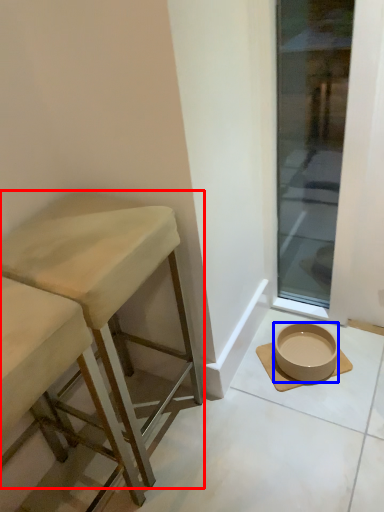
Question: Among these objects, which one is nearest to the camera, stool (highlighted by a red box) or bowl (highlighted by a blue box)?

Choices:
 (A) stool
 (B) bowl

Answer: (A)